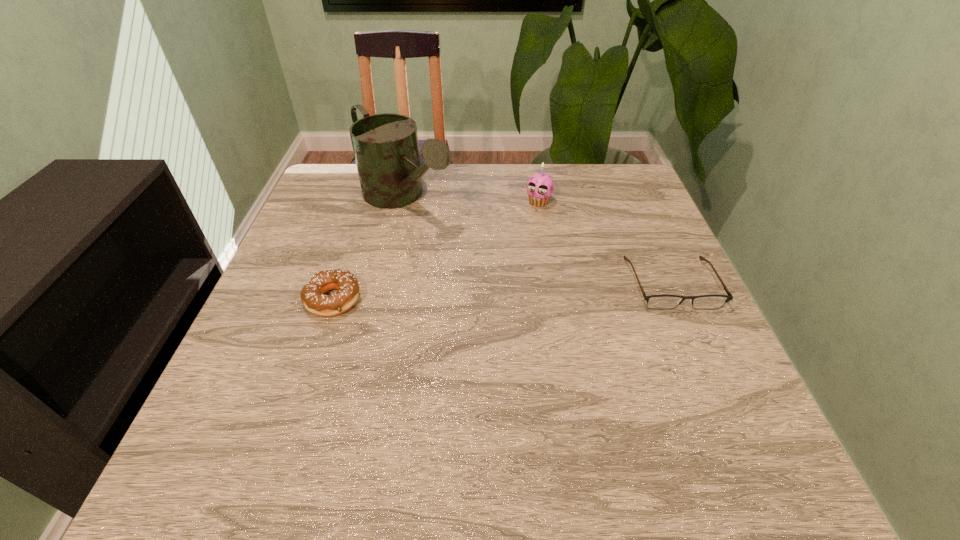
The image size is (960, 540). I want to click on vacant space on the desktop that is between the doughnut and the rightmost object and is positioned with the spout on the watering can, so click(519, 291).

You are a GUI agent. You are given a task and a screenshot of the screen. Output one action in this format:
    pyautogui.click(x=<x>, y=<y>)
    Task: Click on the free space on the desktop that is between the doughnut and the rightmost object and is positioned on the face of the cupcake
    
    Given the screenshot: What is the action you would take?
    pyautogui.click(x=483, y=292)